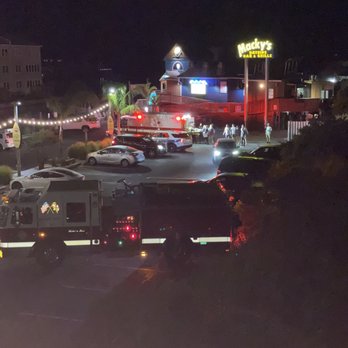
Where is `lights`? The width and height of the screenshot is (348, 348). lights is located at coordinates (52, 123), (90, 114), (107, 105), (24, 121), (6, 123).